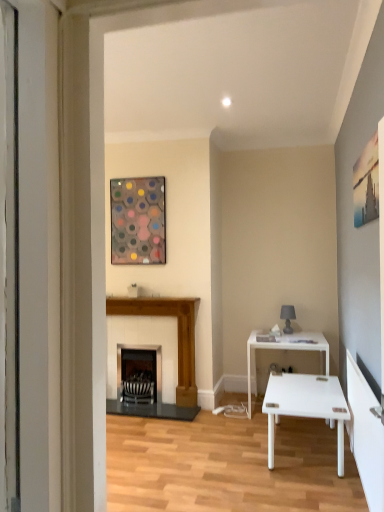
Question: Does matte gray lampshade at right come behind metallic hexagonal artwork at upper center?

Choices:
 (A) no
 (B) yes

Answer: (B)

Question: Is matte gray lampshade at right surrounding metallic hexagonal artwork at upper center?

Choices:
 (A) yes
 (B) no

Answer: (B)

Question: Is matte gray lampshade at right thinner than metallic hexagonal artwork at upper center?

Choices:
 (A) no
 (B) yes

Answer: (A)

Question: Is matte gray lampshade at right at the right side of metallic hexagonal artwork at upper center?

Choices:
 (A) no
 (B) yes

Answer: (B)

Question: Is matte gray lampshade at right bigger than metallic hexagonal artwork at upper center?

Choices:
 (A) no
 (B) yes

Answer: (A)

Question: From a real-world perspective, is matte gray lampshade at right positioned above or below black striped fireplace at center, the first fireplace positioned from the left?

Choices:
 (A) above
 (B) below

Answer: (A)

Question: From the image's perspective, is matte gray lampshade at right located above or below black striped fireplace at center, acting as the second fireplace starting from the right?

Choices:
 (A) below
 (B) above

Answer: (B)

Question: Is point (281, 316) closer or farther from the camera than point (140, 365)?

Choices:
 (A) farther
 (B) closer

Answer: (B)

Question: Choose the correct answer: Is matte gray lampshade at right inside black striped fireplace at center, acting as the second fireplace starting from the right, or outside it?

Choices:
 (A) outside
 (B) inside

Answer: (A)

Question: Based on their positions, is metallic hexagonal artwork at upper center located to the left or right of black striped fireplace at center, the first fireplace positioned from the left?

Choices:
 (A) left
 (B) right

Answer: (A)

Question: From a real-world perspective, is metallic hexagonal artwork at upper center physically located above or below black striped fireplace at center, acting as the second fireplace starting from the right?

Choices:
 (A) above
 (B) below

Answer: (A)

Question: Relative to black striped fireplace at center, the first fireplace positioned from the left, is metallic hexagonal artwork at upper center in front or behind?

Choices:
 (A) behind
 (B) front

Answer: (B)

Question: In terms of width, does metallic hexagonal artwork at upper center look wider or thinner when compared to black striped fireplace at center, acting as the second fireplace starting from the right?

Choices:
 (A) wide
 (B) thin

Answer: (B)

Question: In terms of size, does black striped fireplace at center, the first fireplace positioned from the left, appear bigger or smaller than wooden fireplace at center, which is counted as the 1th fireplace, starting from the right?

Choices:
 (A) small
 (B) big

Answer: (A)

Question: From the image's perspective, relative to wooden fireplace at center, arranged as the 2th fireplace when viewed from the left, is black striped fireplace at center, the first fireplace positioned from the left, above or below?

Choices:
 (A) below
 (B) above

Answer: (A)